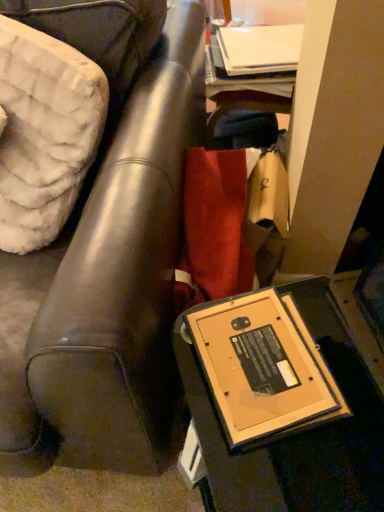
At what (x,y) coordinates should I click in order to perform the action: click on blank space situated above wooden table at lower right (from a real-world perspective). Please return your answer as a coordinate pair (x, y). The width and height of the screenshot is (384, 512). Looking at the image, I should click on (304, 394).